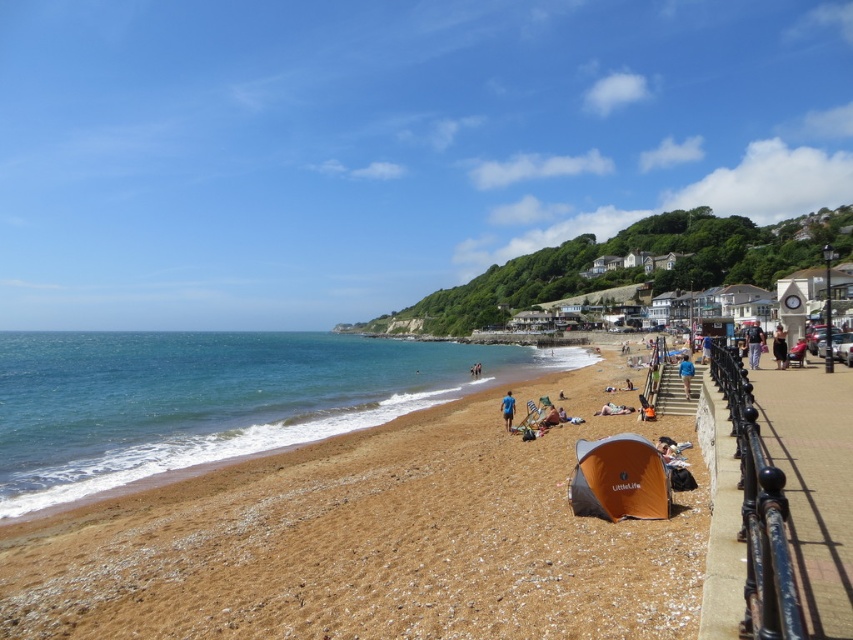
You are a photographer trying to capture both the dark brown fabric dress at lower right and the blue fabric tent at lower center in a single frame. Which object should you focus on first to ensure both are in the frame without moving the camera?

You should focus on the dark brown fabric dress at lower right first because it is larger than the blue fabric tent at lower center, so centering it first will allow the smaller tent to fit into the frame more easily.